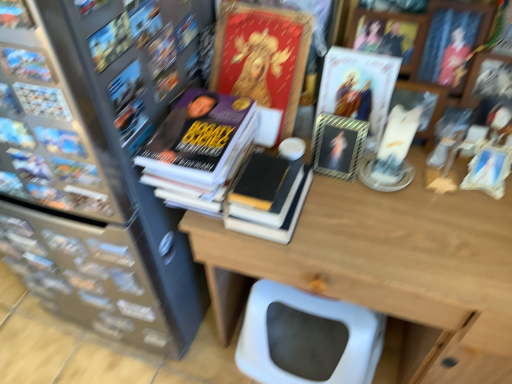
Identify the location of free point above wooden table at center (from a real-world perspective). (400, 210).